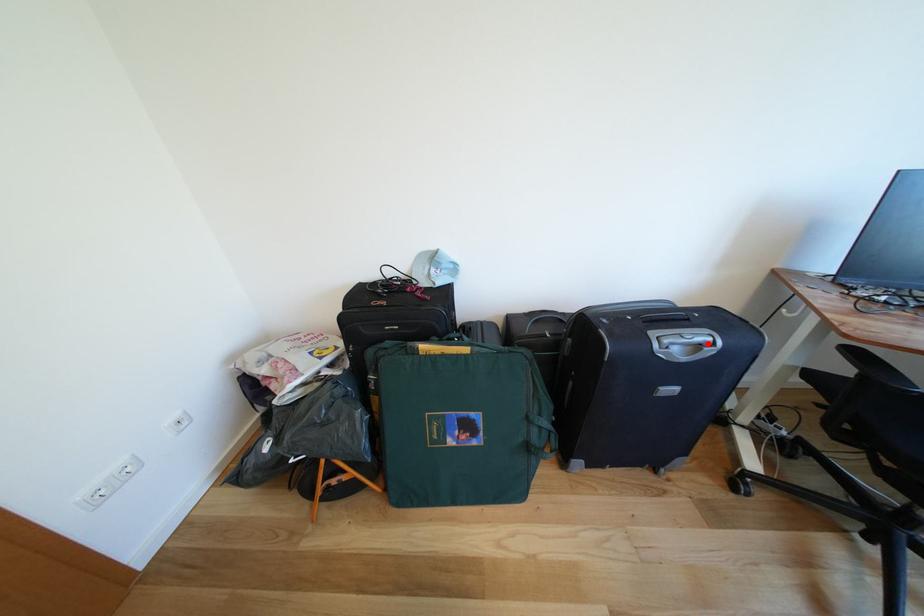
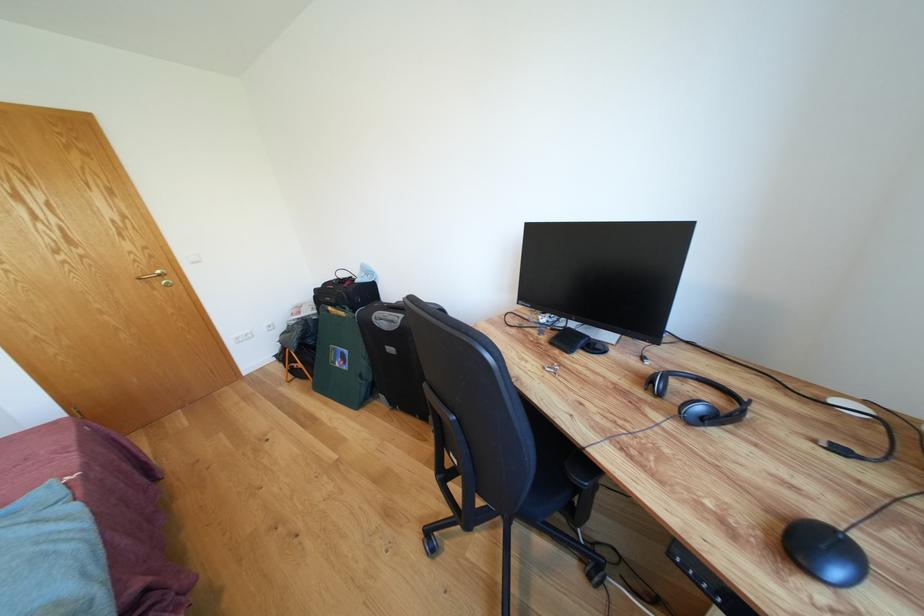
Where in the second image is the point corresponding to the highlighted location from the first image?

(398, 322)